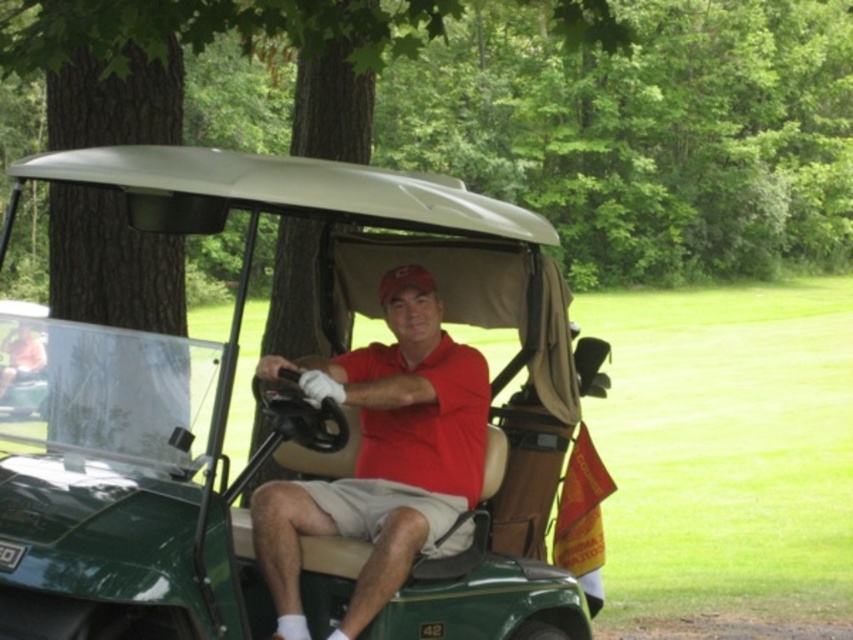
You are a photographer standing in front of the green matte golf cart at center and the matte red shirt at center. You want to take a photo that includes both objects in the frame. Which object should you position closer to the camera to ensure both are visible without moving the cart or shirt?

You should position the matte red shirt at center closer to the camera because it is located below the green matte golf cart at center. By moving the shirt up towards the cart, both objects will be within the frame without needing to adjust their original positions.

Based on the scene description, what are the coordinates of the green matte golf cart at center?

The 2D coordinates of the green matte golf cart at center are at point (271,412).